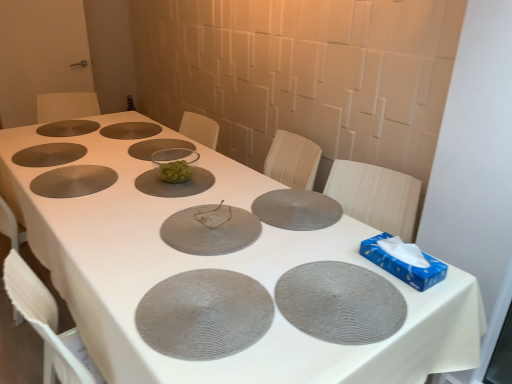
Locate an element on the screen. Image resolution: width=512 pixels, height=384 pixels. vacant space that is in between matte gray glass plate at center, placed as the third glass plate when sorted from front to back, and matte gray placemat at center, which ranks as the 4th glass plate in front-to-back order is located at coordinates tap(252, 215).